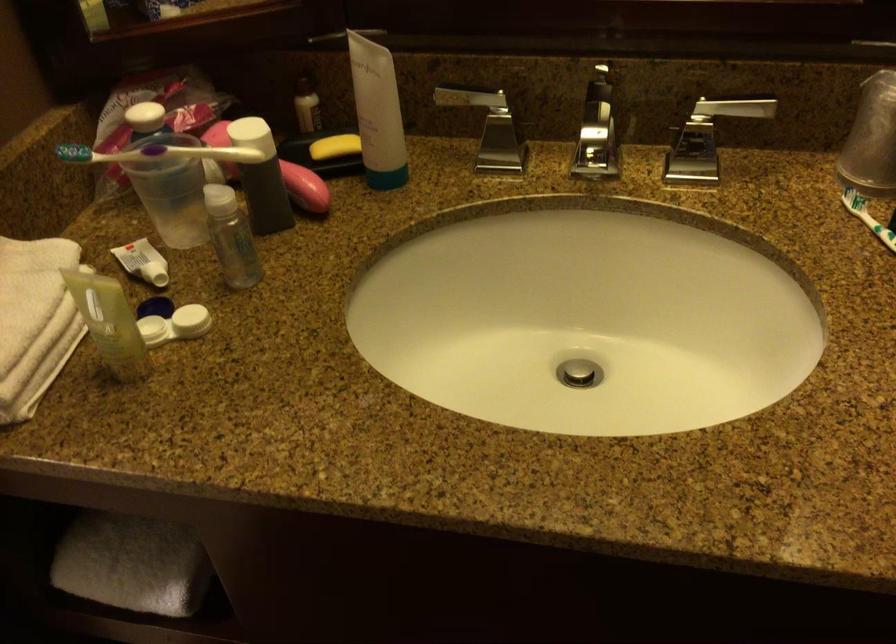
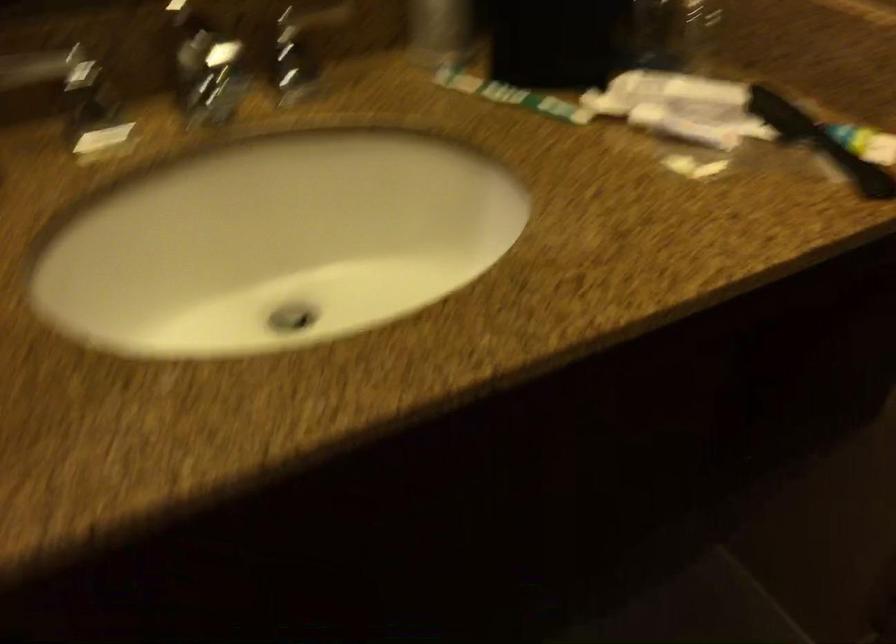
Question: The first image is from the beginning of the video and the second image is from the end. How did the camera likely rotate when shooting the video?

Choices:
 (A) Left
 (B) Right
 (C) Up
 (D) Down

Answer: (B)